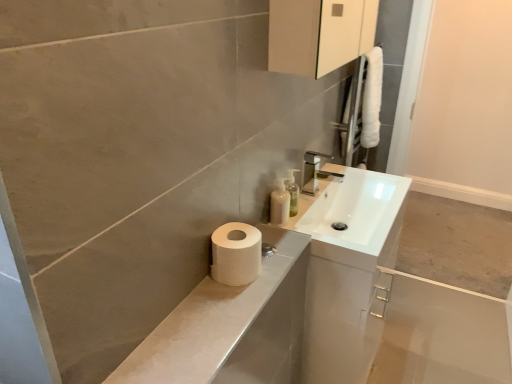
Find the location of a particular element. This screenshot has width=512, height=384. vacant space to the right of white matte toilet paper at lower left is located at coordinates (277, 264).